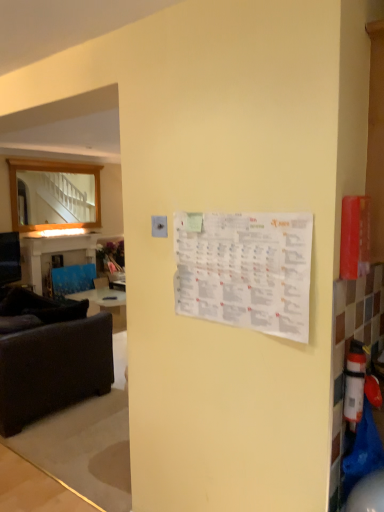
Question: Can you confirm if wooden frame mirror at left is bigger than white paper calendar at center?

Choices:
 (A) no
 (B) yes

Answer: (B)

Question: Does wooden frame mirror at left have a greater height compared to white paper calendar at center?

Choices:
 (A) no
 (B) yes

Answer: (B)

Question: Is wooden frame mirror at left thinner than white paper calendar at center?

Choices:
 (A) yes
 (B) no

Answer: (B)

Question: From a real-world perspective, is wooden frame mirror at left beneath white paper calendar at center?

Choices:
 (A) no
 (B) yes

Answer: (A)

Question: Considering the relative sizes of wooden frame mirror at left and white paper calendar at center in the image provided, is wooden frame mirror at left shorter than white paper calendar at center?

Choices:
 (A) yes
 (B) no

Answer: (B)

Question: Would you say blue fabric table at left is to the left or to the right of velvet blue armchair at left in the picture?

Choices:
 (A) left
 (B) right

Answer: (A)

Question: Is blue fabric table at left inside the boundaries of velvet blue armchair at left, or outside?

Choices:
 (A) inside
 (B) outside

Answer: (B)

Question: Is blue fabric table at left in front of or behind velvet blue armchair at left in the image?

Choices:
 (A) front
 (B) behind

Answer: (A)

Question: Is point (x=72, y=250) closer or farther from the camera than point (x=69, y=284)?

Choices:
 (A) closer
 (B) farther

Answer: (B)

Question: In terms of size, does velvet blue armchair at left appear bigger or smaller than white plastic extinguisher at right?

Choices:
 (A) big
 (B) small

Answer: (A)

Question: Is point (94, 268) positioned closer to the camera than point (354, 397)?

Choices:
 (A) farther
 (B) closer

Answer: (A)

Question: Is velvet blue armchair at left inside the boundaries of white plastic extinguisher at right, or outside?

Choices:
 (A) outside
 (B) inside

Answer: (A)

Question: From a real-world perspective, is velvet blue armchair at left above or below white plastic extinguisher at right?

Choices:
 (A) below
 (B) above

Answer: (A)

Question: Is velvet blue armchair at left to the left or to the right of dark brown fabric studio couch at left in the image?

Choices:
 (A) right
 (B) left

Answer: (B)

Question: From the image's perspective, is velvet blue armchair at left positioned above or below dark brown fabric studio couch at left?

Choices:
 (A) above
 (B) below

Answer: (A)